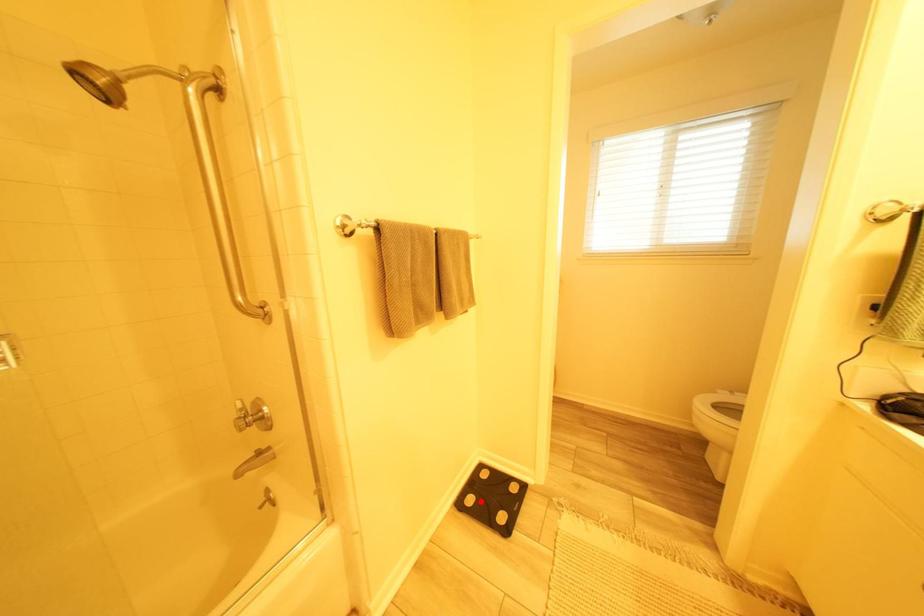
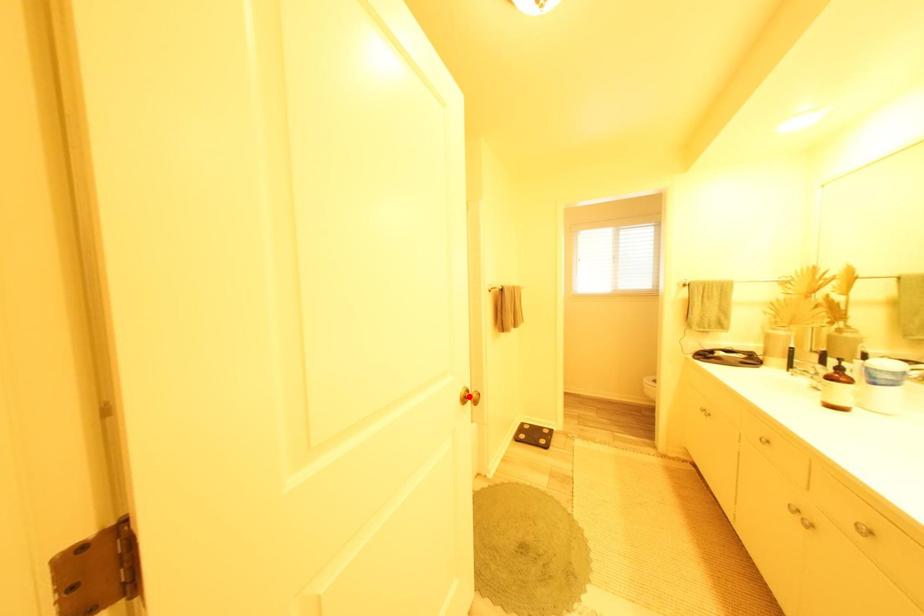
I am providing you with two images of the same scene from different viewpoints. A red point is marked on the first image and another point is marked on the second image. Does the point marked in image1 correspond to the same location as the one in image2?

No